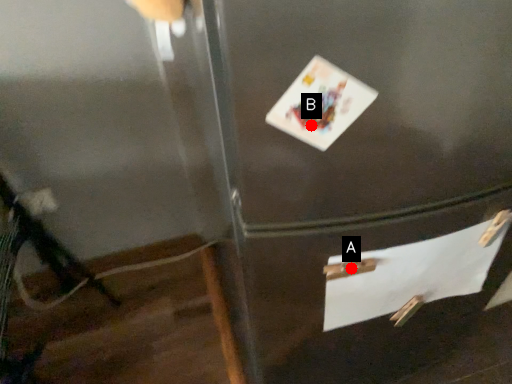
Question: Two points are circled on the image, labeled by A and B beside each circle. Among these points, which one is nearest to the camera?

Choices:
 (A) A is closer
 (B) B is closer

Answer: (B)